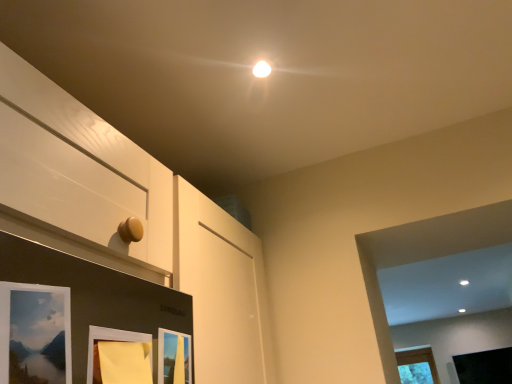
Question: Considering the relative sizes of yellow paper at lower center, positioned as the 2th picture frame in left-to-right order, and matte wooden picture frame at lower left, the first picture frame when ordered from front to back, in the image provided, is yellow paper at lower center, positioned as the 2th picture frame in left-to-right order, shorter than matte wooden picture frame at lower left, the first picture frame when ordered from front to back,?

Choices:
 (A) no
 (B) yes

Answer: (B)

Question: Can you confirm if yellow paper at lower center, arranged as the 3th picture frame when viewed from the back, is positioned to the left of matte wooden picture frame at lower left, positioned as the fourth picture frame in right-to-left order?

Choices:
 (A) no
 (B) yes

Answer: (A)

Question: From a real-world perspective, is yellow paper at lower center, the third picture frame in the bottom-to-top sequence, physically above matte wooden picture frame at lower left, acting as the fourth picture frame starting from the back?

Choices:
 (A) yes
 (B) no

Answer: (B)

Question: Does yellow paper at lower center, arranged as the 3th picture frame when viewed from the back, come in front of matte wooden picture frame at lower left, which is the first picture frame in left-to-right order?

Choices:
 (A) no
 (B) yes

Answer: (A)

Question: Are yellow paper at lower center, arranged as the second picture frame when viewed from the front, and matte wooden picture frame at lower left, the first picture frame when ordered from front to back, located far from each other?

Choices:
 (A) yes
 (B) no

Answer: (B)

Question: Is yellow paper at lower center, the third picture frame in the bottom-to-top sequence, not inside matte wooden picture frame at lower left, which appears as the first picture frame when viewed from the top?

Choices:
 (A) no
 (B) yes

Answer: (B)

Question: Considering the relative positions of yellow paper at lower center, the third picture frame in the bottom-to-top sequence, and black matte picture frame at lower right, which is counted as the 1th picture frame, starting from the right, in the image provided, is yellow paper at lower center, the third picture frame in the bottom-to-top sequence, behind black matte picture frame at lower right, which is counted as the 1th picture frame, starting from the right,?

Choices:
 (A) yes
 (B) no

Answer: (B)

Question: Considering the relative sizes of yellow paper at lower center, arranged as the second picture frame when viewed from the front, and black matte picture frame at lower right, which is the fourth picture frame from top to bottom, in the image provided, is yellow paper at lower center, arranged as the second picture frame when viewed from the front, smaller than black matte picture frame at lower right, which is the fourth picture frame from top to bottom,?

Choices:
 (A) yes
 (B) no

Answer: (A)

Question: Does yellow paper at lower center, the third picture frame in the bottom-to-top sequence, have a larger size compared to black matte picture frame at lower right, the fourth picture frame positioned from the left?

Choices:
 (A) yes
 (B) no

Answer: (B)

Question: Is yellow paper at lower center, the third picture frame in the bottom-to-top sequence, next to black matte picture frame at lower right, which is the fourth picture frame from top to bottom, and touching it?

Choices:
 (A) no
 (B) yes

Answer: (A)

Question: From the image's perspective, is yellow paper at lower center, which appears as the 2th picture frame when viewed from the top, over black matte picture frame at lower right, arranged as the fourth picture frame when viewed from the front?

Choices:
 (A) yes
 (B) no

Answer: (A)

Question: Can black matte picture frame at lower right, which is the fourth picture frame from top to bottom, be found inside yellow paper at lower center, the 3th picture frame in the right-to-left sequence?

Choices:
 (A) yes
 (B) no

Answer: (B)

Question: Is yellow paper at lower center, arranged as the 3th picture frame when viewed from the back, positioned before matte wooden picture frame at lower center, the 3th picture frame when ordered from left to right?

Choices:
 (A) yes
 (B) no

Answer: (A)